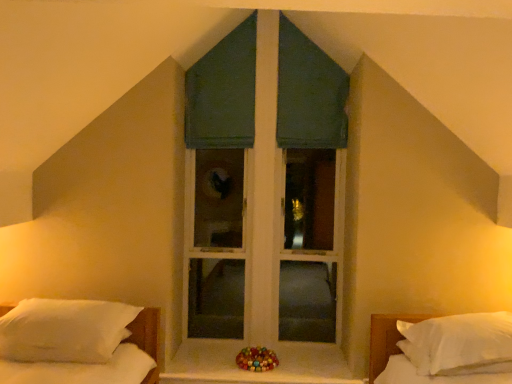
In order to click on blank space situated above white matte window sill at center (from a real-world perspective) in this screenshot , I will do `click(222, 363)`.